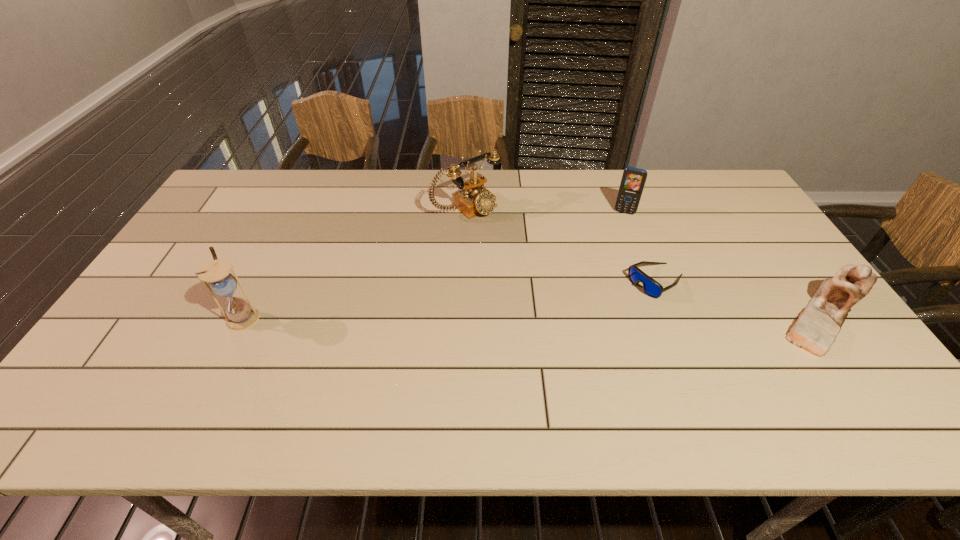
Locate an element on the screen. Image resolution: width=960 pixels, height=540 pixels. free space on the desktop that is between the leftmost object and the figurine and is positioned on the screen of the cellular telephone is located at coordinates (597, 316).

Locate an element on the screen. free spot on the desktop that is between the leftmost object and the figurine and is positioned on the front-facing side of the sunglasses is located at coordinates (600, 316).

Find the location of `vacant space on the desktop that is between the leftmost object and the rightmost object and is positioned on the dial number of the second object from left to right`. vacant space on the desktop that is between the leftmost object and the rightmost object and is positioned on the dial number of the second object from left to right is located at coordinates (595, 316).